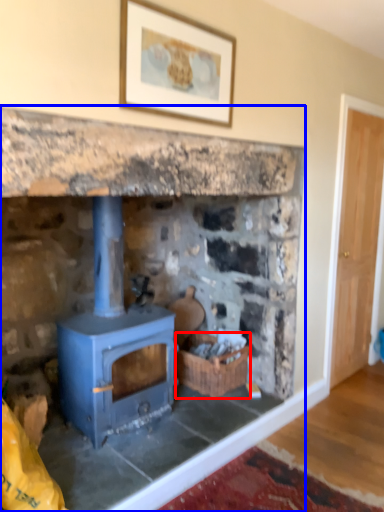
Question: Which point is closer to the camera, basket (highlighted by a red box) or fireplace (highlighted by a blue box)?

Choices:
 (A) basket
 (B) fireplace

Answer: (B)